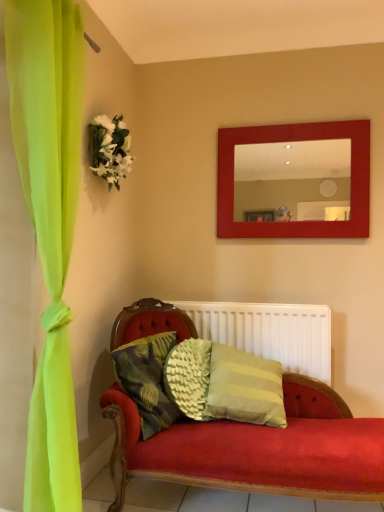
Question: Is white silk flowers at upper left taller or shorter than matte red mirror at upper center?

Choices:
 (A) tall
 (B) short

Answer: (B)

Question: Is white silk flowers at upper left wider or thinner than matte red mirror at upper center?

Choices:
 (A) wide
 (B) thin

Answer: (A)

Question: Considering the real-world distances, which object is farthest from the textured green pillow at center?

Choices:
 (A) white silk flowers at upper left
 (B) matte red mirror at upper center
 (C) white matte radiator at center

Answer: (B)

Question: Which object is positioned farthest from the matte red mirror at upper center?

Choices:
 (A) white matte radiator at center
 (B) white silk flowers at upper left
 (C) textured green pillow at center

Answer: (C)